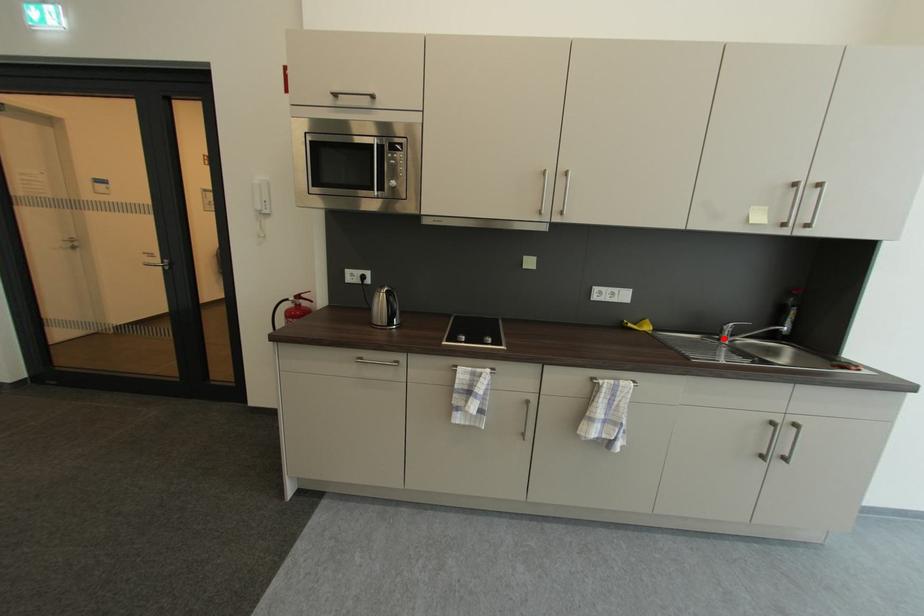
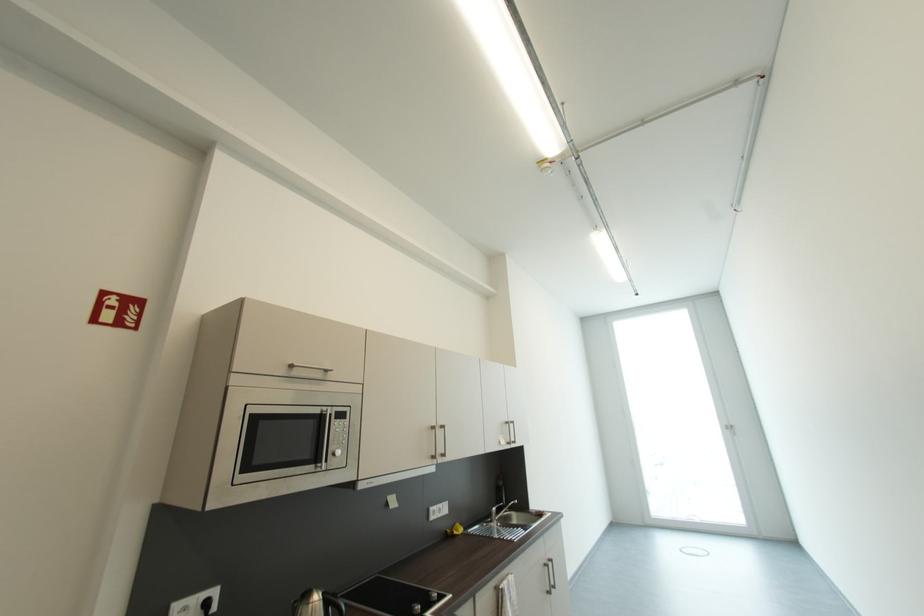
Question: I am providing you with two images of the same scene from different viewpoints. A red point is shown in image1. For the corresponding object point in image2, is it positioned nearer or farther from the camera?

Choices:
 (A) Nearer
 (B) Farther

Answer: (B)